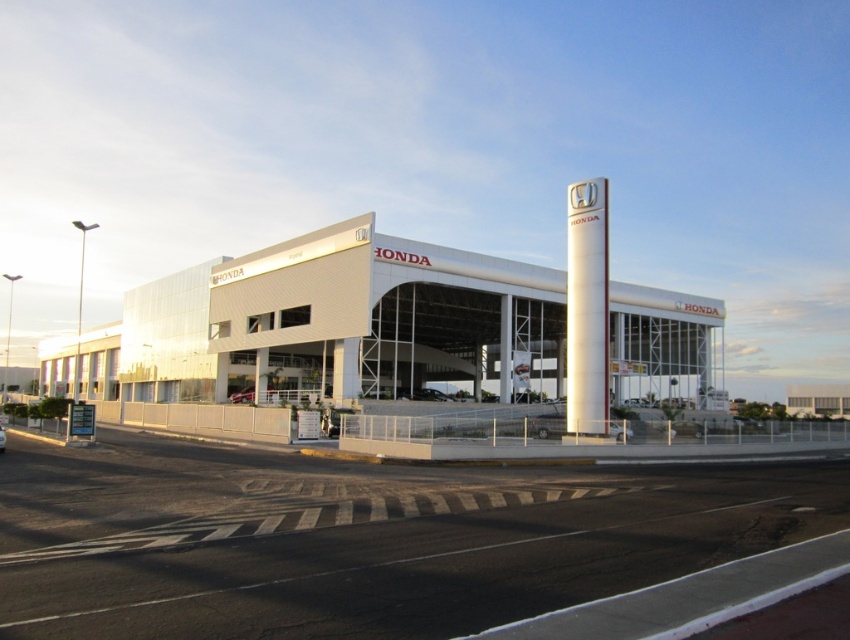
Question: Which point is farther from the camera taking this photo?

Choices:
 (A) (3, 445)
 (B) (590, 276)

Answer: (B)

Question: Is white smooth pillar at center to the left of white glossy pillar at center from the viewer's perspective?

Choices:
 (A) no
 (B) yes

Answer: (A)

Question: Is the position of white matte building at center more distant than that of white glossy pillar at center?

Choices:
 (A) no
 (B) yes

Answer: (A)

Question: Observing the image, what is the correct spatial positioning of white smooth pillar at center in reference to white glossy pillar at center?

Choices:
 (A) right
 (B) left

Answer: (A)

Question: Which object is farther from the camera taking this photo?

Choices:
 (A) white matte building at center
 (B) metallic silver sedan at center
 (C) white glossy pillar at center
 (D) white smooth pillar at center

Answer: (C)

Question: Which point is closer to the camera?

Choices:
 (A) white smooth pillar at center
 (B) metallic silver sedan at center
 (C) white matte building at center

Answer: (B)